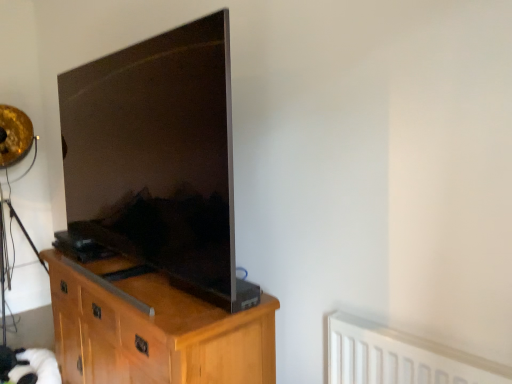
What is the approximate height of white plastic radiator at lower right?

The height of white plastic radiator at lower right is 10.98 inches.

This screenshot has width=512, height=384. Describe the element at coordinates (153, 330) in the screenshot. I see `light wood cabinet at center` at that location.

The image size is (512, 384). I want to click on matte black tv at left, so click(x=158, y=157).

Where is `white plastic radiator at lower right`? The height and width of the screenshot is (384, 512). white plastic radiator at lower right is located at coordinates (399, 357).

Find the location of a particular element. cabinetry on the left side of white plastic radiator at lower right is located at coordinates (153, 330).

Who is bigger, white plastic radiator at lower right or light wood cabinet at center?

Bigger between the two is light wood cabinet at center.

Looking at this image, are white plastic radiator at lower right and light wood cabinet at center beside each other?

No, white plastic radiator at lower right is not in contact with light wood cabinet at center.

Considering their positions, is light wood cabinet at center located in front of or behind white plastic radiator at lower right?

light wood cabinet at center is positioned farther from the viewer than white plastic radiator at lower right.

Who is shorter, light wood cabinet at center or white plastic radiator at lower right?

With less height is white plastic radiator at lower right.

Can you tell me how much light wood cabinet at center and white plastic radiator at lower right differ in facing direction?

The angle between the facing direction of light wood cabinet at center and the facing direction of white plastic radiator at lower right is 0.595 degrees.

Is light wood cabinet at center directly adjacent to matte black tv at left?

No, light wood cabinet at center is not next to matte black tv at left.

From the picture: In the image, is light wood cabinet at center on the left side or the right side of matte black tv at left?

In the image, light wood cabinet at center appears on the right side of matte black tv at left.

In terms of size, does light wood cabinet at center appear bigger or smaller than matte black tv at left?

light wood cabinet at center is bigger than matte black tv at left.

From the image's perspective, is light wood cabinet at center over matte black tv at left?

No, from the image's perspective, light wood cabinet at center is not above matte black tv at left.

In the image, is matte black tv at left on the left side or the right side of light wood cabinet at center?

matte black tv at left is to the left of light wood cabinet at center.

From the image's perspective, which is above, matte black tv at left or light wood cabinet at center?

From the image's view, matte black tv at left is above.

Is light wood cabinet at center a part of matte black tv at left?

No, light wood cabinet at center is not inside matte black tv at left.

Is matte black tv at left in front of or behind light wood cabinet at center in the image?

matte black tv at left is in front of light wood cabinet at center.

Considering the positions of objects matte black tv at left and white plastic radiator at lower right in the image provided, who is in front, matte black tv at left or white plastic radiator at lower right?

white plastic radiator at lower right is more forward.

Between matte black tv at left and white plastic radiator at lower right, which one appears on the right side from the viewer's perspective?

white plastic radiator at lower right.

Does matte black tv at left have a smaller size compared to white plastic radiator at lower right?

No.

Is matte black tv at left positioned with its back to white plastic radiator at lower right?

matte black tv at left is not turned away from white plastic radiator at lower right.

Is white plastic radiator at lower right smaller than matte black tv at left?

Indeed, white plastic radiator at lower right has a smaller size compared to matte black tv at left.

Looking at this image, between white plastic radiator at lower right and matte black tv at left, which one has less height?

Standing shorter between the two is white plastic radiator at lower right.

From the picture: From a real-world perspective, is white plastic radiator at lower right under matte black tv at left?

Yes, from a real-world perspective, white plastic radiator at lower right is below matte black tv at left.

Which object is positioned more to the left, white plastic radiator at lower right or matte black tv at left?

matte black tv at left.

Locate an element on the screen. This screenshot has height=384, width=512. cabinetry lying behind the white plastic radiator at lower right is located at coordinates 153,330.

Find the location of `cabinetry below the white plastic radiator at lower right (from the image's perspective)`. cabinetry below the white plastic radiator at lower right (from the image's perspective) is located at coordinates (153, 330).

Estimate the real-world distances between objects in this image. Which object is further from light wood cabinet at center, white plastic radiator at lower right or matte black tv at left?

white plastic radiator at lower right is further to light wood cabinet at center.

When comparing their distances from white plastic radiator at lower right, does matte black tv at left or light wood cabinet at center seem further?

matte black tv at left is further to white plastic radiator at lower right.

Based on their spatial positions, is white plastic radiator at lower right or light wood cabinet at center further from matte black tv at left?

Based on the image, white plastic radiator at lower right appears to be further to matte black tv at left.

From the image, which object appears to be nearer to white plastic radiator at lower right, light wood cabinet at center or matte black tv at left?

light wood cabinet at center is closer to white plastic radiator at lower right.

Based on their spatial positions, is matte black tv at left or white plastic radiator at lower right further from light wood cabinet at center?

Based on the image, white plastic radiator at lower right appears to be further to light wood cabinet at center.

Estimate the real-world distances between objects in this image. Which object is closer to matte black tv at left, light wood cabinet at center or white plastic radiator at lower right?

Based on the image, light wood cabinet at center appears to be nearer to matte black tv at left.

In order to click on cabinetry between matte black tv at left and white plastic radiator at lower right in this screenshot , I will do `click(153, 330)`.